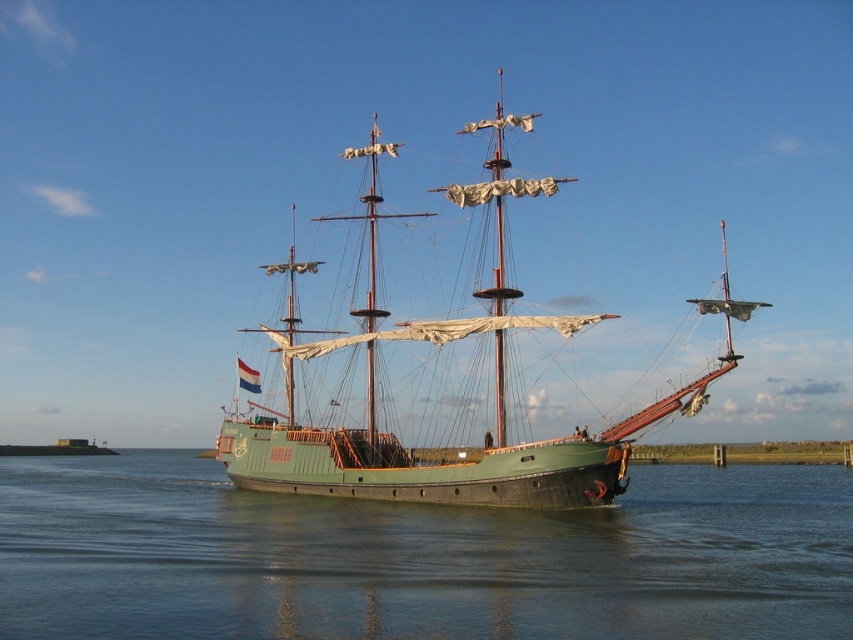
Between point (490, 572) and point (724, 369), which one is positioned in front?

Point (490, 572) is in front.

Is green matte water at center shorter than green matte sailboat at center?

Yes, green matte water at center is shorter than green matte sailboat at center.

Does point (480, 604) come closer to viewer compared to point (561, 492)?

Yes, point (480, 604) is in front of point (561, 492).

Where is `green matte water at center`? green matte water at center is located at coordinates (416, 557).